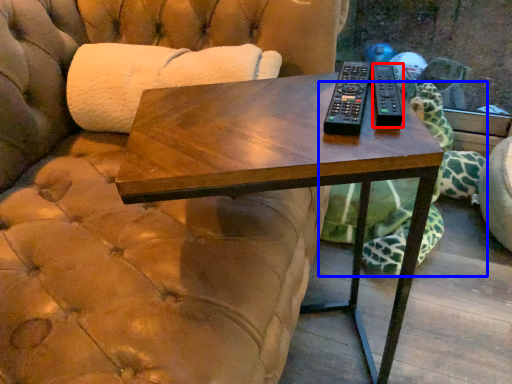
Question: Which point is closer to the camera, remote (highlighted by a red box) or tortoise (highlighted by a blue box)?

Choices:
 (A) remote
 (B) tortoise

Answer: (A)